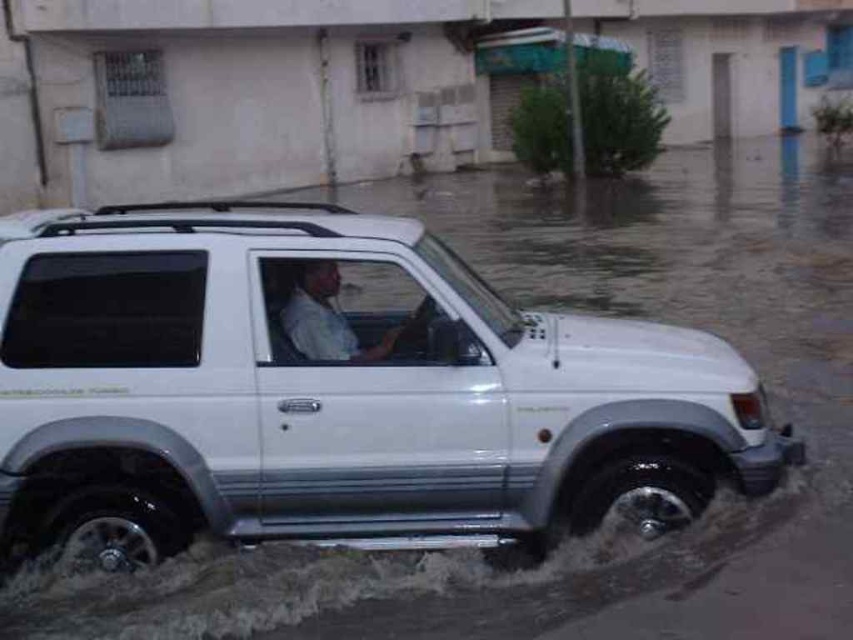
Which is more to the right, silty gray mud at lower center or white matte shirt at center?

From the viewer's perspective, silty gray mud at lower center appears more on the right side.

Is point (45, 620) positioned after point (329, 324)?

Yes, it is.

Describe the element at coordinates (370, 582) in the screenshot. I see `silty gray mud at lower center` at that location.

At what (x,y) coordinates should I click in order to perform the action: click on silty gray mud at lower center. Please return your answer as a coordinate pair (x, y). Looking at the image, I should click on (370, 582).

Does white matte suv at center have a greater width compared to white matte shirt at center?

Correct, the width of white matte suv at center exceeds that of white matte shirt at center.

Is point (230, 422) more distant than point (294, 342)?

No, (230, 422) is closer to viewer.

Where is `white matte suv at center`? This screenshot has width=853, height=640. white matte suv at center is located at coordinates (335, 394).

Between white matte suv at center and silty gray mud at lower center, which one has more height?

Standing taller between the two is white matte suv at center.

Looking at this image, who is more forward, (416, 269) or (434, 588)?

Point (416, 269) is more forward.

Where is `white matte suv at center`? white matte suv at center is located at coordinates (335, 394).